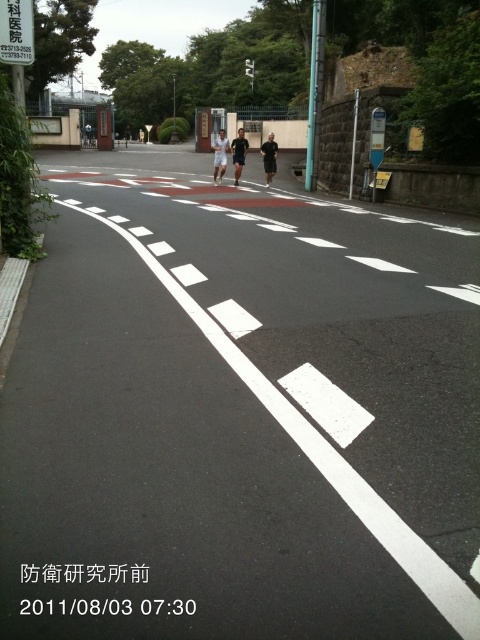
Based on the scene described, can you determine if the white plastic sign at upper left is wider than the black matte shirt at center?

The white plastic sign at upper left might be wider than the black matte shirt at center according to the description.

You are a runner participating in a marathon and you see the white plastic sign at upper left and the white matte shirt at center. Which object is taller?

The white plastic sign at upper left is taller than the white matte shirt at center.

You are a runner participating in a marathon and see the white plastic sign at upper left and the black matte shirt at center. Which object is positioned to the left of the other?

The white plastic sign at upper left is to the left of the black matte shirt at center.